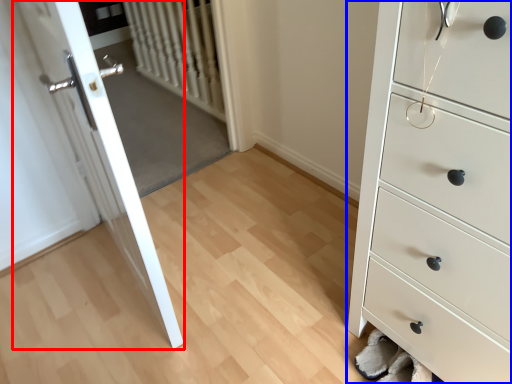
Question: Which object is further to the camera taking this photo, door (highlighted by a red box) or chest of drawers (highlighted by a blue box)?

Choices:
 (A) door
 (B) chest of drawers

Answer: (A)